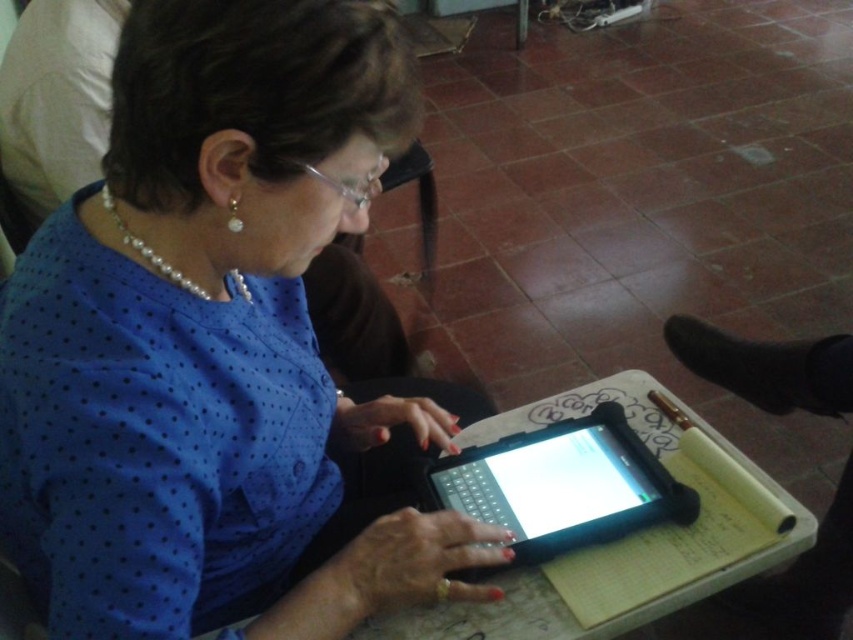
Looking at this image, does blue dotted shirt at center have a lesser width compared to white paper at center?

Yes, blue dotted shirt at center is thinner than white paper at center.

Can you confirm if blue dotted shirt at center is positioned below white paper at center?

Actually, blue dotted shirt at center is above white paper at center.

Which is behind, point (259, 579) or point (375, 637)?

The point (259, 579) is more distant.

Where is `blue dotted shirt at center`? This screenshot has width=853, height=640. blue dotted shirt at center is located at coordinates (218, 346).

Consider the image. Who is positioned more to the left, black rubberized tablet at center or white paper at center?

black rubberized tablet at center is more to the left.

Can you confirm if black rubberized tablet at center is positioned below white paper at center?

Actually, black rubberized tablet at center is above white paper at center.

What do you see at coordinates (561, 484) in the screenshot? I see `black rubberized tablet at center` at bounding box center [561, 484].

Locate an element on the screen. Image resolution: width=853 pixels, height=640 pixels. black rubberized tablet at center is located at coordinates (561, 484).

Can you confirm if blue dotted shirt at center is thinner than black rubberized tablet at center?

In fact, blue dotted shirt at center might be wider than black rubberized tablet at center.

Is point (142, 506) behind point (619, 504)?

No, (142, 506) is closer to viewer.

Image resolution: width=853 pixels, height=640 pixels. Find the location of `blue dotted shirt at center`. blue dotted shirt at center is located at coordinates (218, 346).